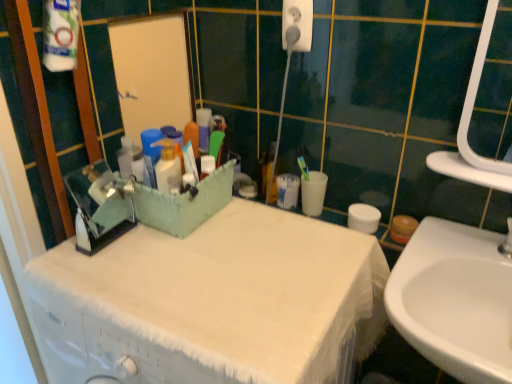
Question: From a real-world perspective, is white plastic electric outlet at upper center on top of white fabric-covered cabinet at center?

Choices:
 (A) no
 (B) yes

Answer: (B)

Question: Does white plastic electric outlet at upper center have a lesser width compared to white fabric-covered cabinet at center?

Choices:
 (A) yes
 (B) no

Answer: (A)

Question: Is there a large distance between white plastic electric outlet at upper center and white fabric-covered cabinet at center?

Choices:
 (A) no
 (B) yes

Answer: (A)

Question: Is white plastic electric outlet at upper center wider than white fabric-covered cabinet at center?

Choices:
 (A) no
 (B) yes

Answer: (A)

Question: Is the position of white plastic electric outlet at upper center less distant than that of white fabric-covered cabinet at center?

Choices:
 (A) yes
 (B) no

Answer: (B)

Question: Considering the relative positions of white plastic electric outlet at upper center and white fabric-covered cabinet at center in the image provided, is white plastic electric outlet at upper center behind white fabric-covered cabinet at center?

Choices:
 (A) no
 (B) yes

Answer: (B)

Question: Is white glossy sink at lower right at the left side of white plastic electric outlet at upper center?

Choices:
 (A) no
 (B) yes

Answer: (A)

Question: Is white glossy sink at lower right oriented away from white plastic electric outlet at upper center?

Choices:
 (A) yes
 (B) no

Answer: (B)

Question: Could you tell me if white glossy sink at lower right is facing white plastic electric outlet at upper center?

Choices:
 (A) yes
 (B) no

Answer: (B)

Question: Is white glossy sink at lower right wider than white plastic electric outlet at upper center?

Choices:
 (A) no
 (B) yes

Answer: (B)

Question: Can you confirm if white glossy sink at lower right is taller than white plastic electric outlet at upper center?

Choices:
 (A) yes
 (B) no

Answer: (A)

Question: Is white glossy sink at lower right to the right of white plastic electric outlet at upper center from the viewer's perspective?

Choices:
 (A) no
 (B) yes

Answer: (B)

Question: Is white plastic electric outlet at upper center to the left of white glossy sink at lower right from the viewer's perspective?

Choices:
 (A) yes
 (B) no

Answer: (A)